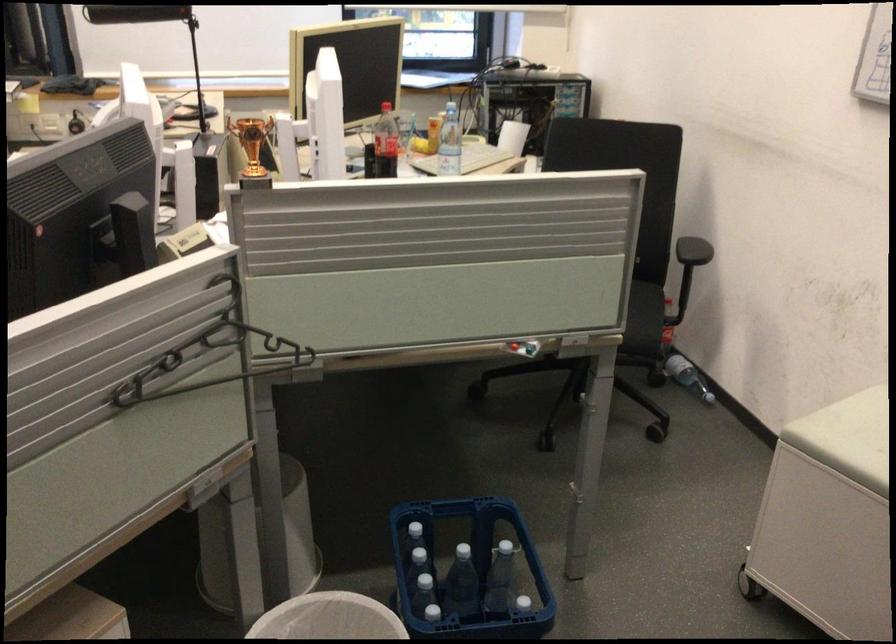
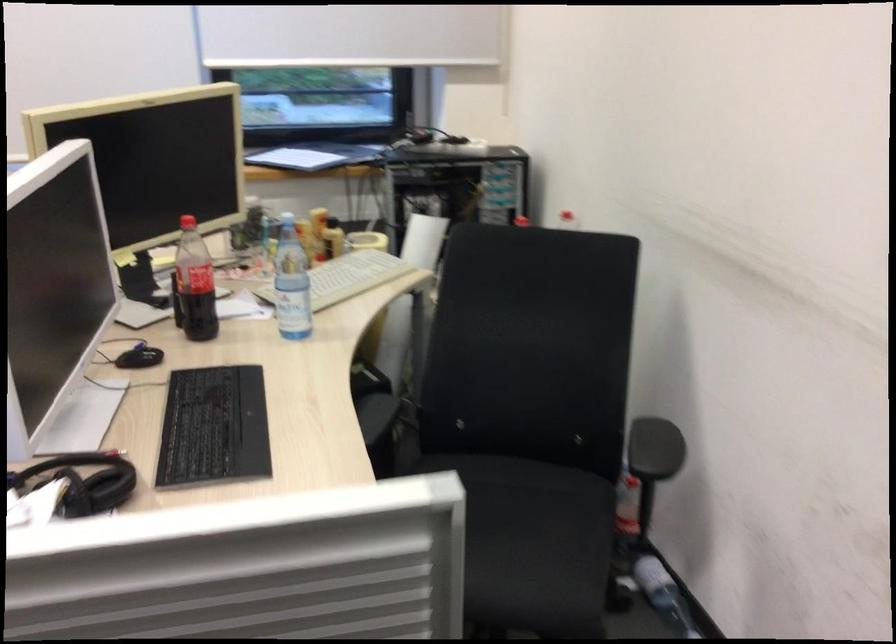
Where in the second image is the point corresponding to (467,156) from the first image?

(347, 277)